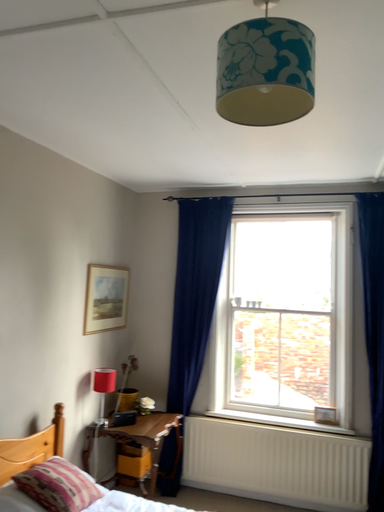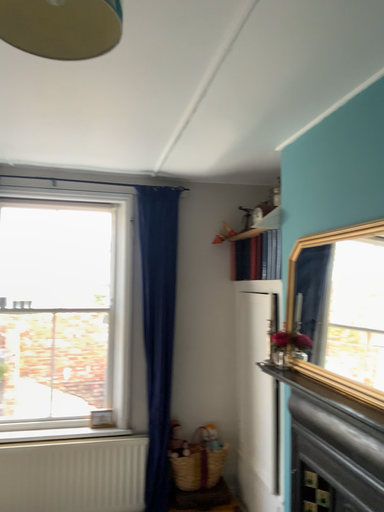
Question: Which way did the camera rotate in the video?

Choices:
 (A) rotated left
 (B) rotated right

Answer: (B)